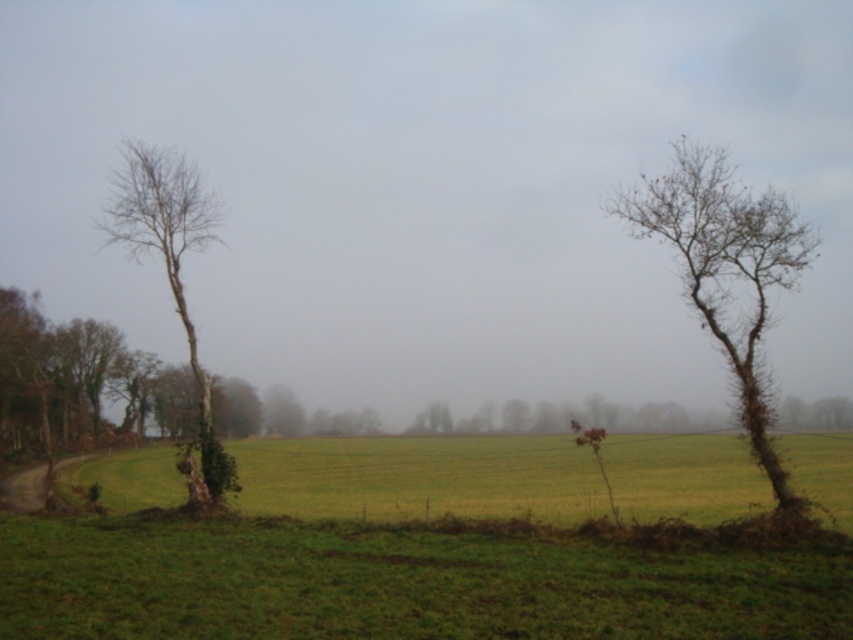
You are standing in the rural landscape and want to take a photo of the green grassy field at lower center and the bare wood tree at left. Which object should you focus on first if you want both to be in clear focus?

The green grassy field at lower center is in front of the bare wood tree at left, so you should focus on the bare wood tree at left first to ensure both are in clear focus.

You are a farmer checking your crops. You notice the green grassy field at lower center and the bare wood tree at right. Which one has a smaller height?

Result: The green grassy field at lower center has a lesser height compared to the bare wood tree at right.

You are a farmer checking the growth of your crops. You notice the green grassy field at lower center and the bare wood tree at left. Which one is taller?

The bare wood tree at left is taller than the green grassy field at lower center.